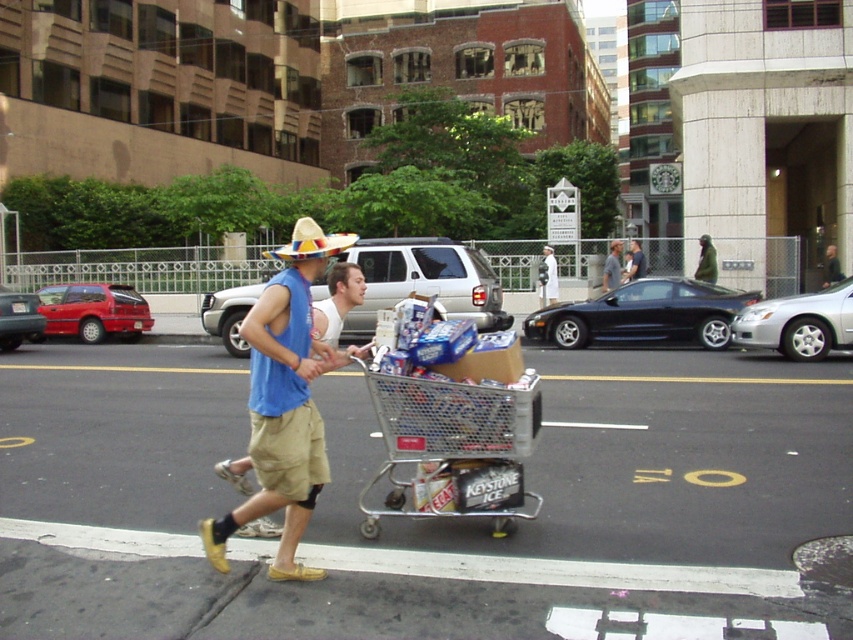
You are standing in the middle of the street and see the metallic silver shopping cart at center and the white cotton shirt at center. Which object is closer to your left side?

The metallic silver shopping cart at center is to the left of the white cotton shirt at center, so it is closer to your left side.

You are a pedestrian walking on the street and see the metallic silver shopping cart at center and the white cotton shirt at center. Which object is closer to you?

The metallic silver shopping cart at center is closer to you because it is in front of the white cotton shirt at center.